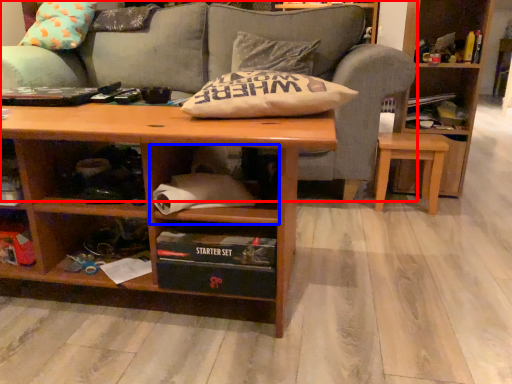
Question: Which object is further to the camera taking this photo, studio couch (highlighted by a red box) or cabinet (highlighted by a blue box)?

Choices:
 (A) studio couch
 (B) cabinet

Answer: (A)